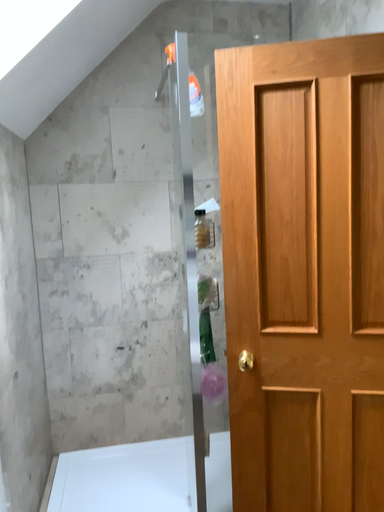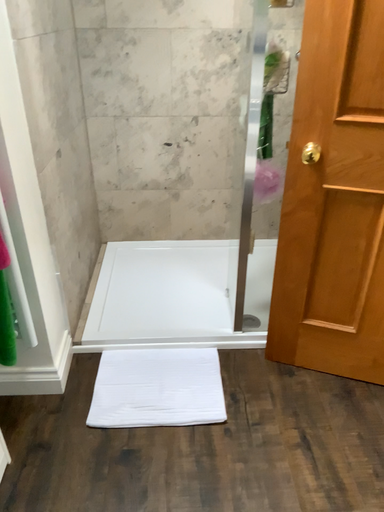
Question: Which way did the camera rotate in the video?

Choices:
 (A) rotated left
 (B) rotated right

Answer: (A)